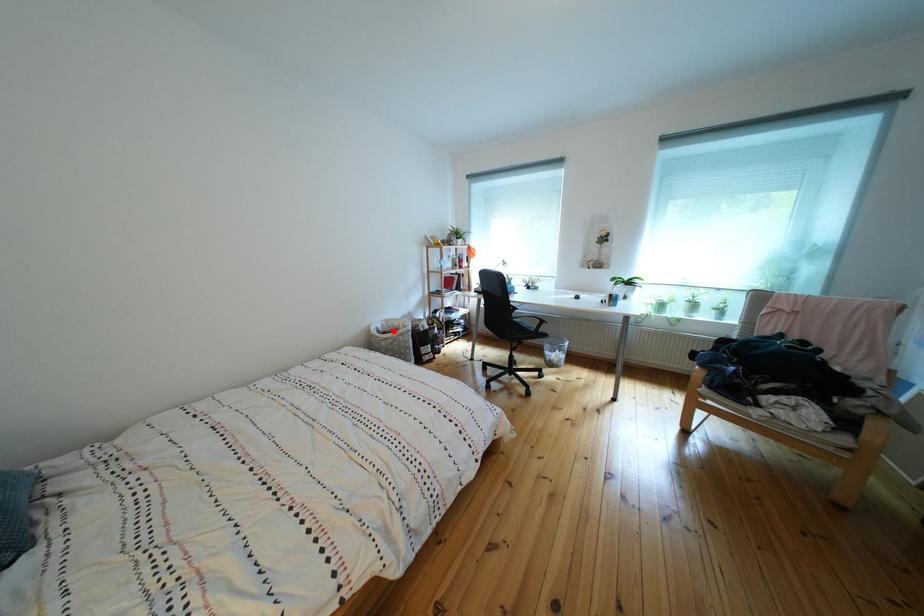
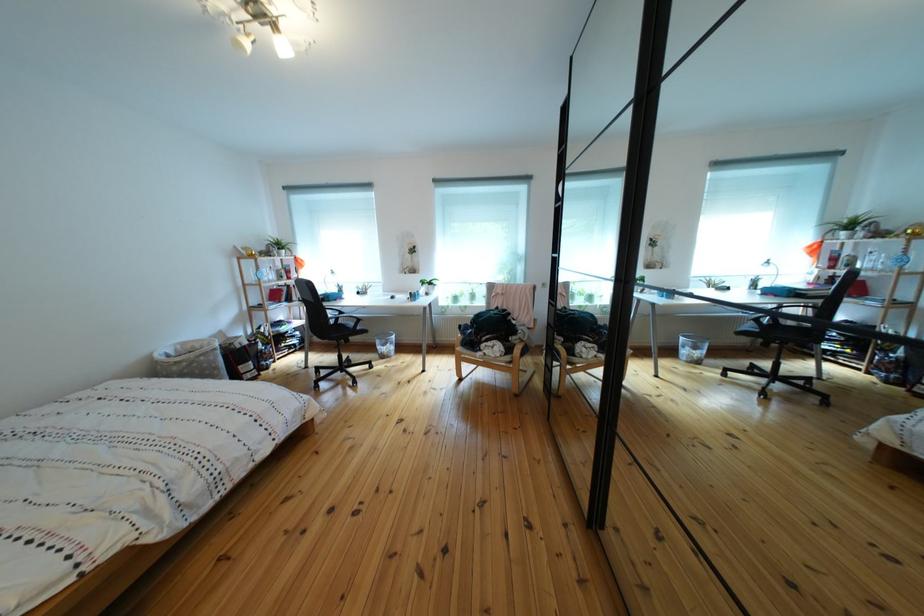
Locate, in the second image, the point that corresponds to the highlighted location in the first image.

(187, 355)